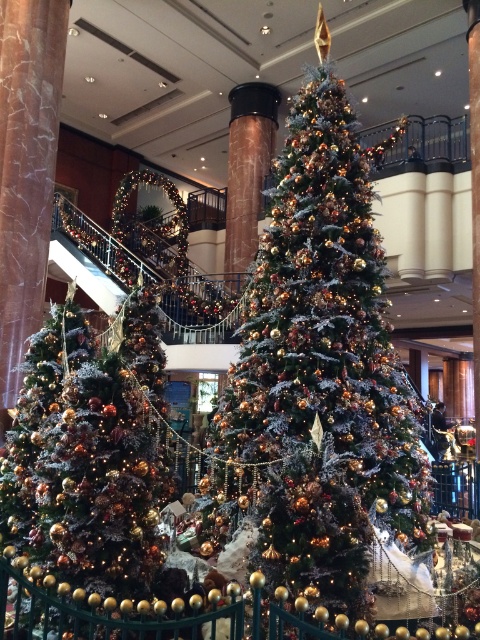
Question: Does frosted glass christmas tree at center appear on the left side of shiny gold ornaments at center?

Choices:
 (A) no
 (B) yes

Answer: (A)

Question: Which object appears closest to the camera in this image?

Choices:
 (A) shiny gold ornaments at center
 (B) frosted glass christmas tree at center

Answer: (B)

Question: Can you confirm if frosted glass christmas tree at center is positioned below shiny gold ornaments at center?

Choices:
 (A) no
 (B) yes

Answer: (A)

Question: Can you confirm if frosted glass christmas tree at center is bigger than shiny gold ornaments at center?

Choices:
 (A) no
 (B) yes

Answer: (B)

Question: Which point appears closest to the camera in this image?

Choices:
 (A) (109, 522)
 (B) (336, 588)

Answer: (B)